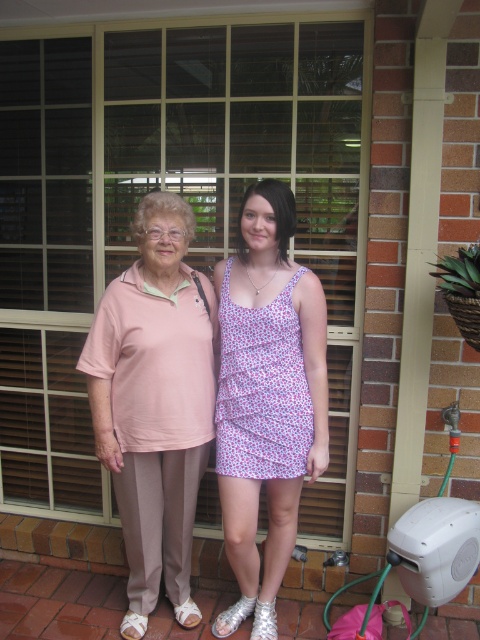
Is pink fabric shirt at left thinner than matte pink blouse at left?

Incorrect, pink fabric shirt at left's width is not less than matte pink blouse at left's.

Measure the distance between point (149, 566) and camera.

2.37 meters

You are a GUI agent. You are given a task and a screenshot of the screen. Output one action in this format:
    pyautogui.click(x=<x>, y=<y>)
    Task: Click on the pink fabric shirt at left
    The width and height of the screenshot is (480, 640).
    Given the screenshot: What is the action you would take?
    pyautogui.click(x=155, y=403)

Who is taller, matte pink blouse at left or pink floral fabric dress at center?

Standing taller between the two is matte pink blouse at left.

Measure the distance between point (251, 488) and camera.

Point (251, 488) is 7.14 feet from camera.

The height and width of the screenshot is (640, 480). I want to click on matte pink blouse at left, so 266,397.

Does pink fabric shirt at left appear over pink floral fabric dress at center?

No, pink fabric shirt at left is not above pink floral fabric dress at center.

Can you confirm if pink fabric shirt at left is smaller than pink floral fabric dress at center?

Actually, pink fabric shirt at left might be larger than pink floral fabric dress at center.

Between point (180, 564) and point (303, 268), which one is positioned in front?

Point (303, 268) is more forward.

Locate an element on the screen. pink fabric shirt at left is located at coordinates (155, 403).